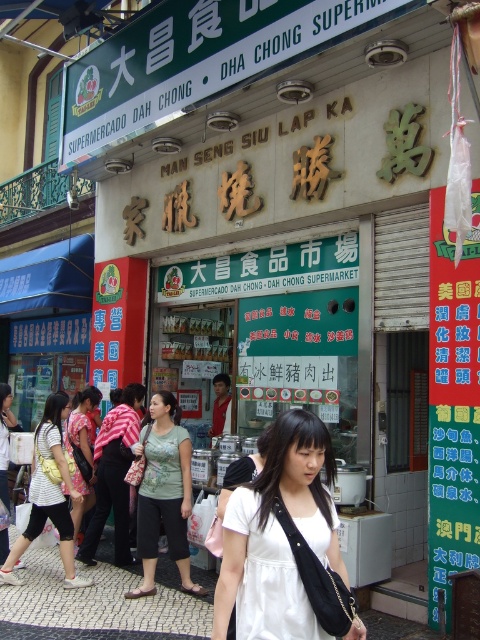
Where is the floral fabric dress at center located in the image?

The floral fabric dress at center is located at point (82, 451) in the image.

You are standing at the entrance of DHA CHONG SUPERMARKET and want to reach the point marked as point (430,454) inside the store. If you walk straight ahead, how far will you have to walk to reach that point?

The distance between point (430,454) and the viewer is 5.69 meters, so you will have to walk 5.69 meters straight ahead to reach that point.

You are a customer entering the supermarket and see both the floral fabric dress at center and the matte white blouse at center through the entrance. Which clothing item is closer to you as you approach the entrance?

The floral fabric dress at center is closer to you because the matte white blouse at center is behind it.